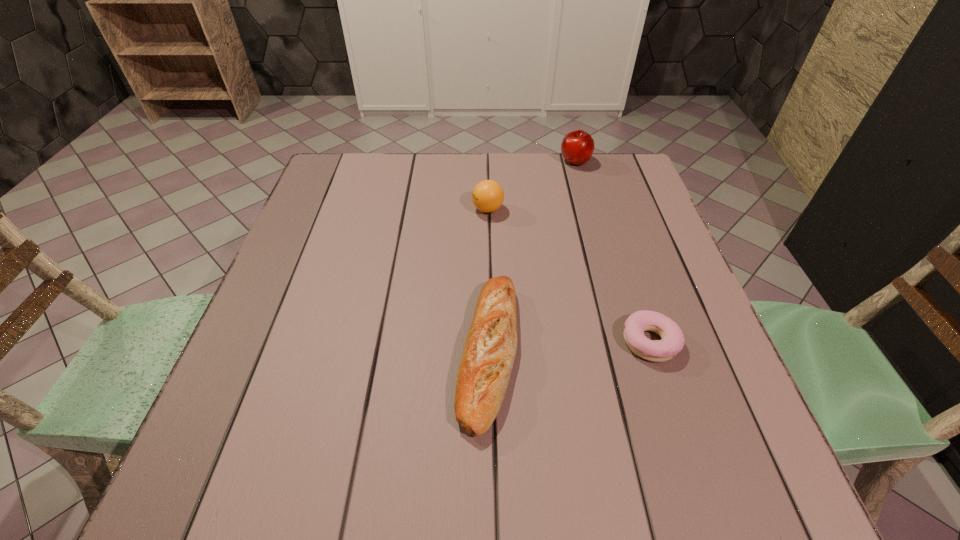
At what (x,y) coordinates should I click in order to perform the action: click on blank area located on the left of the baguet. Please return your answer as a coordinate pair (x, y). The height and width of the screenshot is (540, 960). Looking at the image, I should click on (338, 353).

Find the location of a particular element. vacant position located on the left of the shortest object is located at coordinates pyautogui.click(x=536, y=342).

Where is `apple that is at the far edge`? This screenshot has height=540, width=960. apple that is at the far edge is located at coordinates (577, 147).

At what (x,y) coordinates should I click in order to perform the action: click on ping-pong ball positioned at the far edge. Please return your answer as a coordinate pair (x, y). This screenshot has width=960, height=540. Looking at the image, I should click on (487, 196).

You are a GUI agent. You are given a task and a screenshot of the screen. Output one action in this format:
    pyautogui.click(x=<x>, y=<y>)
    Task: Click on the apple located at the right edge
    This screenshot has height=540, width=960.
    Given the screenshot: What is the action you would take?
    pyautogui.click(x=577, y=147)

Locate an element on the screen. The height and width of the screenshot is (540, 960). doughnut that is at the right edge is located at coordinates (673, 340).

Find the location of a particular element. object that is at the far right corner is located at coordinates (577, 147).

Where is `blank space at the far edge of the desktop`? Image resolution: width=960 pixels, height=540 pixels. blank space at the far edge of the desktop is located at coordinates (521, 187).

Image resolution: width=960 pixels, height=540 pixels. What are the coordinates of `free space at the near edge` in the screenshot? It's located at (552, 453).

Find the location of `vacant space at the left edge`. vacant space at the left edge is located at coordinates (341, 232).